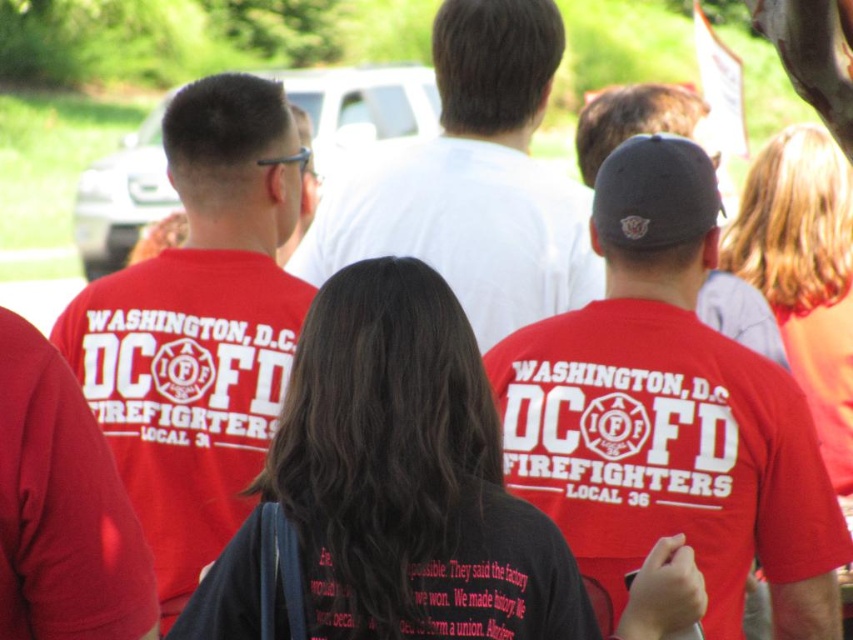
You are a photographer trying to capture a photo of the group of people wearing red Tshirts. You are standing at point (392,280). If you move towards point (653,342), will you be moving towards the front or the back of the group?

Point (653,342) is behind point (392,280), so moving towards it would mean you are moving towards the back of the group.

You are a photographer trying to capture a detailed shot of the logo on the red T shirts. You notice two points of interest marked as point 1 at coordinates point (717,545) and point 2 at coordinates point (225,253). Which point should you focus on to ensure the logo is in sharp focus?

Point 1 at coordinates point (717,545) is closer to the camera than point 2 at coordinates point (225,253), so focusing on point 1 will ensure the logo is in sharp focus.